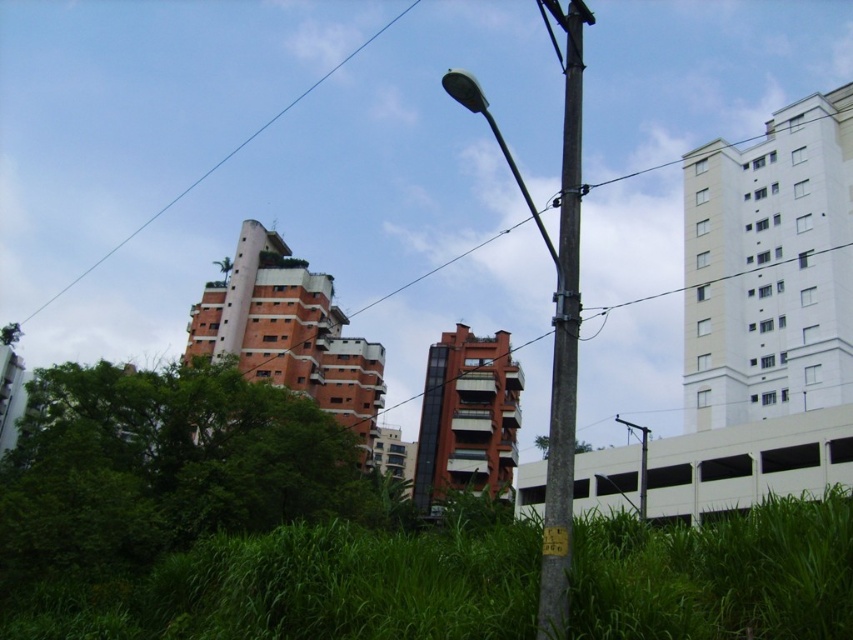
Is point (109, 612) closer to viewer compared to point (563, 573)?

No.

Can you confirm if green grass at lower center is taller than brown wooden telegraph pole at center?

No, green grass at lower center is not taller than brown wooden telegraph pole at center.

Is point (241, 548) behind point (561, 163)?

No.

Image resolution: width=853 pixels, height=640 pixels. Find the location of `green grass at lower center`. green grass at lower center is located at coordinates (306, 589).

Who is positioned more to the left, green grass at lower center or metallic pole at center?

green grass at lower center is more to the left.

Is point (743, 620) farther from viewer compared to point (614, 416)?

No, it is in front of (614, 416).

Is point (520, 566) farther from camera compared to point (645, 461)?

No.

The height and width of the screenshot is (640, 853). I want to click on green grass at lower center, so click(306, 589).

Is point (572, 177) positioned in front of point (561, 541)?

That is False.

Between metallic gray pole at center and yellow plastic street sign at lower center, which one has more height?

With more height is metallic gray pole at center.

This screenshot has width=853, height=640. Describe the element at coordinates (553, 298) in the screenshot. I see `metallic gray pole at center` at that location.

This screenshot has height=640, width=853. I want to click on metallic gray pole at center, so click(x=553, y=298).